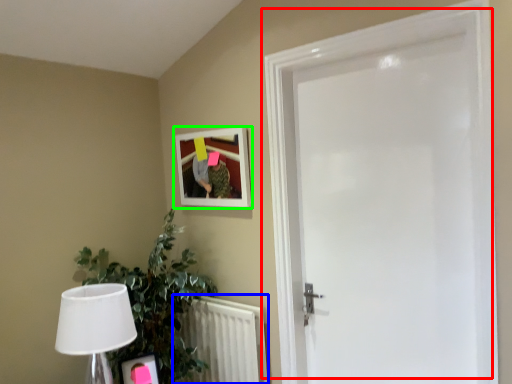
Question: Estimate the real-world distances between objects in this image. Which object is closer to door (highlighted by a red box), radiator (highlighted by a blue box) or picture frame (highlighted by a green box)?

Choices:
 (A) radiator
 (B) picture frame

Answer: (B)